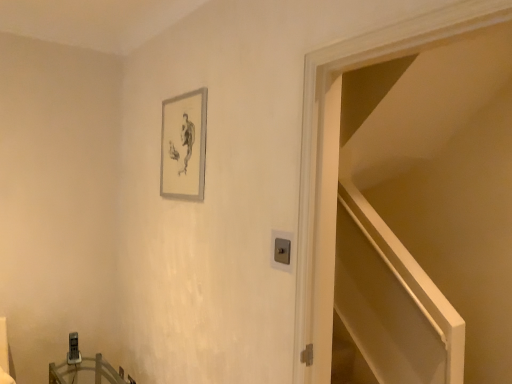
Question: From the image's perspective, would you say wooden table at lower left is shown under white glossy door at upper right?

Choices:
 (A) yes
 (B) no

Answer: (A)

Question: Is wooden table at lower left aimed at white glossy door at upper right?

Choices:
 (A) yes
 (B) no

Answer: (B)

Question: From a real-world perspective, is wooden table at lower left on white glossy door at upper right?

Choices:
 (A) yes
 (B) no

Answer: (B)

Question: Considering the relative sizes of wooden table at lower left and white glossy door at upper right in the image provided, is wooden table at lower left wider than white glossy door at upper right?

Choices:
 (A) no
 (B) yes

Answer: (B)

Question: Is the depth of wooden table at lower left greater than that of white glossy door at upper right?

Choices:
 (A) no
 (B) yes

Answer: (B)

Question: Does wooden table at lower left have a smaller size compared to white glossy door at upper right?

Choices:
 (A) yes
 (B) no

Answer: (A)

Question: From a real-world perspective, is silver metallic picture frame at upper center beneath white glossy door at upper right?

Choices:
 (A) yes
 (B) no

Answer: (B)

Question: Is silver metallic picture frame at upper center positioned before white glossy door at upper right?

Choices:
 (A) yes
 (B) no

Answer: (B)

Question: Is silver metallic picture frame at upper center placed right next to white glossy door at upper right?

Choices:
 (A) yes
 (B) no

Answer: (B)

Question: Does silver metallic picture frame at upper center appear on the left side of white glossy door at upper right?

Choices:
 (A) no
 (B) yes

Answer: (B)

Question: Is silver metallic picture frame at upper center not near white glossy door at upper right?

Choices:
 (A) yes
 (B) no

Answer: (B)

Question: Is silver metallic picture frame at upper center behind white glossy door at upper right?

Choices:
 (A) no
 (B) yes

Answer: (B)

Question: From a real-world perspective, is silver metallic picture frame at upper center positioned under wooden table at lower left based on gravity?

Choices:
 (A) yes
 (B) no

Answer: (B)